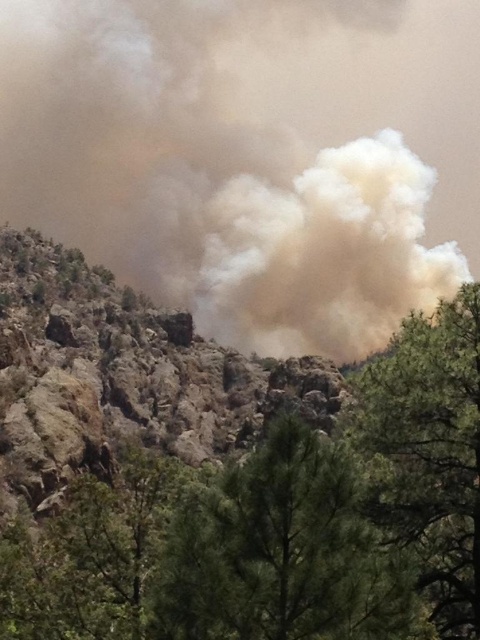
What are the coordinates of the brown dusty cloud at center?

The brown dusty cloud at center is located at coordinates point (x=252, y=156).

You are a firefighter trying to navigate through the forest to reach the wildfire. You see two points marked in the image. Which point is closer to you as you stand at the entrance of the forest? The points are point (87, 204) and point (47, 349).

Point (47, 349) is closer to you because it is less further to the camera than point (87, 204).